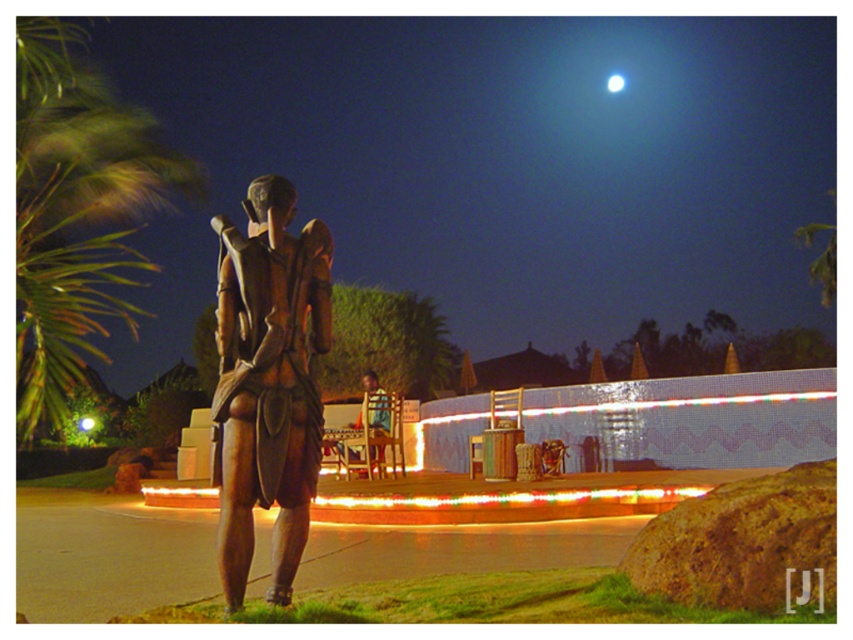
Looking at this image, which is more to the left, wooden chair at center or bright white sphere at upper center?

From the viewer's perspective, wooden chair at center appears more on the left side.

Is wooden chair at center below bright white sphere at upper center?

Indeed, wooden chair at center is positioned under bright white sphere at upper center.

Measure the distance between wooden chair at center and camera.

wooden chair at center and camera are 29.57 feet apart.

The width and height of the screenshot is (853, 640). In order to click on wooden chair at center in this screenshot , I will do pos(376,404).

Is green leafy palm tree at left thinner than bronze statue at center?

Incorrect, green leafy palm tree at left's width is not less than bronze statue at center's.

Is green leafy palm tree at left smaller than bronze statue at center?

Incorrect, green leafy palm tree at left is not smaller in size than bronze statue at center.

Who is more distant from viewer, (90,307) or (251,417)?

Point (90,307)

Where is `green leafy palm tree at left`? green leafy palm tree at left is located at coordinates (76, 212).

Which is below, green leafy palm tree at left or wooden chair at center?

Positioned lower is wooden chair at center.

Does green leafy palm tree at left lie in front of wooden chair at center?

Yes, it is in front of wooden chair at center.

Does point (54, 172) lie in front of point (357, 451)?

No, (54, 172) is behind (357, 451).

Identify the location of green leafy palm tree at left. The width and height of the screenshot is (853, 640). (76, 212).